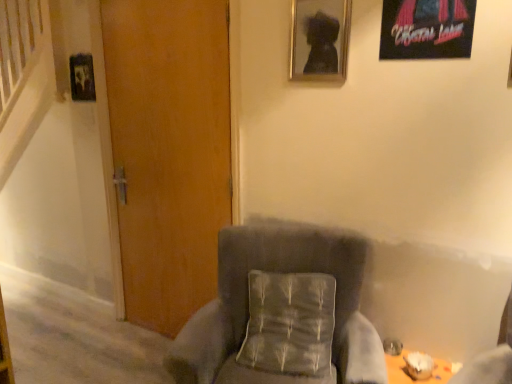
Question: From a real-world perspective, is metallic poster at upper right, the first picture frame positioned from the right, on matte black picture frame at upper center, which is the second picture frame from right to left?

Choices:
 (A) no
 (B) yes

Answer: (B)

Question: Is metallic poster at upper right, the third picture frame viewed from the back, not inside matte black picture frame at upper center, which is the second picture frame from right to left?

Choices:
 (A) yes
 (B) no

Answer: (A)

Question: Considering the relative sizes of metallic poster at upper right, acting as the first picture frame starting from the front, and matte black picture frame at upper center, which is the second picture frame from right to left, in the image provided, is metallic poster at upper right, acting as the first picture frame starting from the front, bigger than matte black picture frame at upper center, which is the second picture frame from right to left,?

Choices:
 (A) yes
 (B) no

Answer: (B)

Question: Can you confirm if metallic poster at upper right, the first picture frame positioned from the right, is smaller than matte black picture frame at upper center, which is the second picture frame from right to left?

Choices:
 (A) yes
 (B) no

Answer: (A)

Question: Is the depth of metallic poster at upper right, arranged as the 3th picture frame when viewed from the left, greater than that of matte black picture frame at upper center, marked as the second picture frame in a left-to-right arrangement?

Choices:
 (A) no
 (B) yes

Answer: (A)

Question: Considering the positions of textured gray pillow at center and metallic poster at upper right, the third picture frame viewed from the back, in the image, is textured gray pillow at center taller or shorter than metallic poster at upper right, the third picture frame viewed from the back,?

Choices:
 (A) tall
 (B) short

Answer: (B)

Question: Is textured gray pillow at center inside or outside of metallic poster at upper right, the third picture frame viewed from the back?

Choices:
 (A) outside
 (B) inside

Answer: (A)

Question: In the image, is textured gray pillow at center positioned in front of or behind metallic poster at upper right, acting as the first picture frame starting from the front?

Choices:
 (A) behind
 (B) front

Answer: (A)

Question: From the image's perspective, relative to metallic poster at upper right, the first picture frame positioned from the right, is textured gray pillow at center above or below?

Choices:
 (A) below
 (B) above

Answer: (A)

Question: From a real-world perspective, is wooden door at center above or below matte black picture frame at upper center, marked as the second picture frame in a left-to-right arrangement?

Choices:
 (A) above
 (B) below

Answer: (B)

Question: Based on their sizes in the image, would you say wooden door at center is bigger or smaller than matte black picture frame at upper center, which is the second picture frame from front to back?

Choices:
 (A) big
 (B) small

Answer: (A)

Question: Is point (221, 18) positioned closer to the camera than point (322, 51)?

Choices:
 (A) farther
 (B) closer

Answer: (A)

Question: Visually, is wooden door at center positioned to the left or to the right of matte black picture frame at upper center, which ranks as the 2th picture frame in back-to-front order?

Choices:
 (A) left
 (B) right

Answer: (A)

Question: Is metallic poster at upper right, the first picture frame positioned from the right, in front of or behind velvet gray armchair at center in the image?

Choices:
 (A) front
 (B) behind

Answer: (B)

Question: Considering the positions of metallic poster at upper right, arranged as the 3th picture frame when viewed from the left, and velvet gray armchair at center in the image, is metallic poster at upper right, arranged as the 3th picture frame when viewed from the left, taller or shorter than velvet gray armchair at center?

Choices:
 (A) short
 (B) tall

Answer: (A)